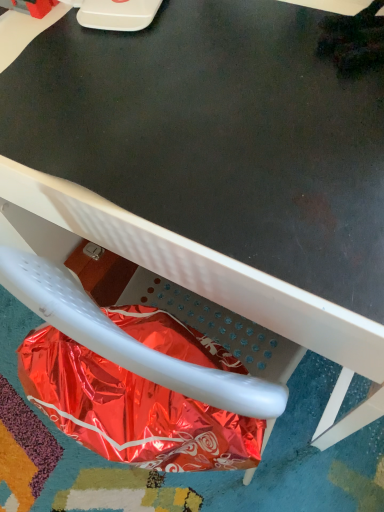
Question: From the image's perspective, is metallic white chair at lower center above or below shiny metallic bag at lower left?

Choices:
 (A) above
 (B) below

Answer: (A)

Question: Considering their positions, is metallic white chair at lower center located in front of or behind shiny metallic bag at lower left?

Choices:
 (A) behind
 (B) front

Answer: (B)

Question: From a real-world perspective, is metallic white chair at lower center above or below shiny metallic bag at lower left?

Choices:
 (A) above
 (B) below

Answer: (B)

Question: Relative to metallic white chair at lower center, is shiny metallic bag at lower left in front or behind?

Choices:
 (A) front
 (B) behind

Answer: (B)

Question: From a real-world perspective, is shiny metallic bag at lower left physically located above or below metallic white chair at lower center?

Choices:
 (A) above
 (B) below

Answer: (A)

Question: Considering the positions of shiny metallic bag at lower left and metallic white chair at lower center in the image, is shiny metallic bag at lower left wider or thinner than metallic white chair at lower center?

Choices:
 (A) thin
 (B) wide

Answer: (A)

Question: In terms of height, does shiny metallic bag at lower left look taller or shorter compared to metallic white chair at lower center?

Choices:
 (A) tall
 (B) short

Answer: (B)